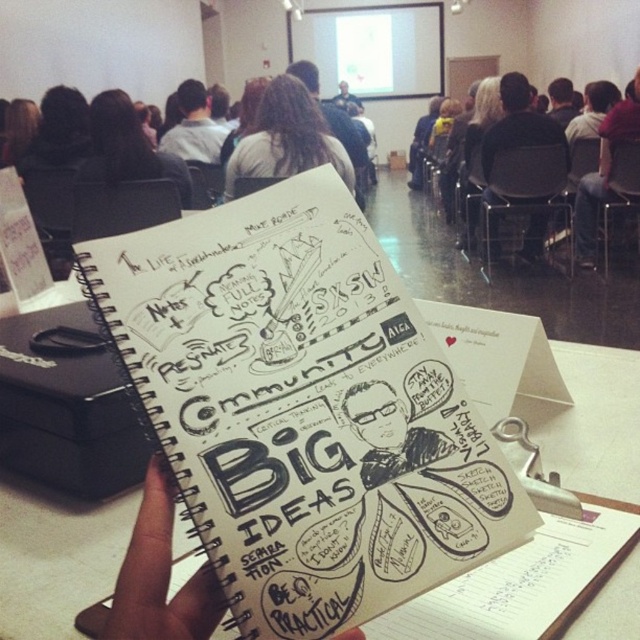
Question: Which of the following is the farthest from the observer?

Choices:
 (A) black paper at center
 (B) white paper notebook at center
 (C) black textured sketchbook at center
 (D) black skin at center

Answer: (C)

Question: Is black skin at center to the right of black paper at center from the viewer's perspective?

Choices:
 (A) no
 (B) yes

Answer: (A)

Question: Is black skin at center smaller than light brown hair at upper center?

Choices:
 (A) no
 (B) yes

Answer: (B)

Question: Which point is closer to the camera taking this photo?

Choices:
 (A) (404, 449)
 (B) (134, 596)
 (C) (500, 97)
 (D) (260, 403)

Answer: (B)

Question: Which point appears farthest from the camera in this image?

Choices:
 (A) (305, 88)
 (B) (125, 564)
 (C) (394, 509)

Answer: (A)

Question: Can you confirm if dark hair at center is positioned to the left of light brown hair at upper center?

Choices:
 (A) no
 (B) yes

Answer: (A)